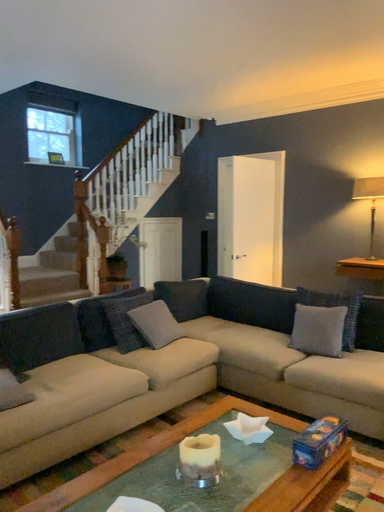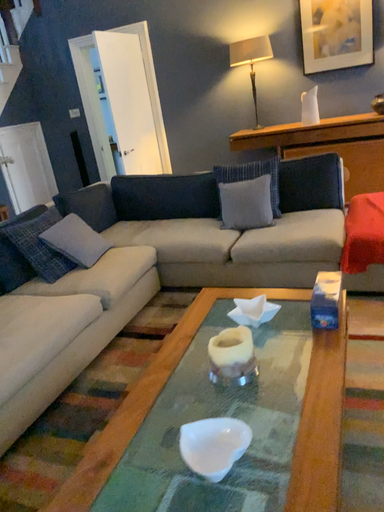
Question: Which way did the camera rotate in the video?

Choices:
 (A) rotated right
 (B) rotated left

Answer: (A)